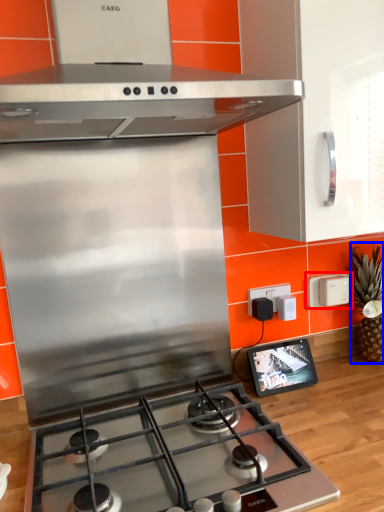
Question: Which of the following is the farthest to the observer, electric outlet (highlighted by a red box) or pineapple (highlighted by a blue box)?

Choices:
 (A) electric outlet
 (B) pineapple

Answer: (A)